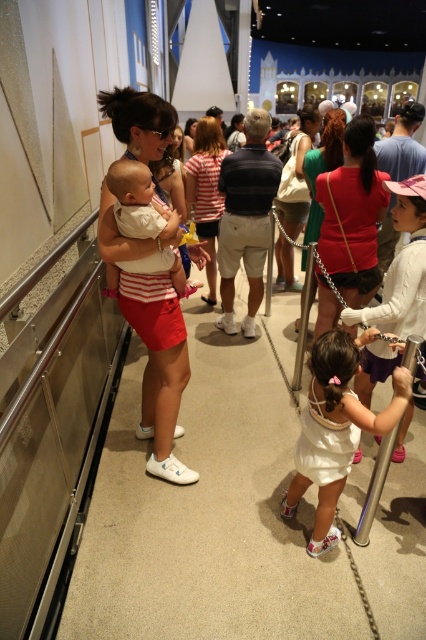
You are standing in the queue line and want to know the position of the matte white shorts at left and the white fabric dress at center. Which one is positioned more to the left?

The matte white shorts at left is positioned more to the left than the white fabric dress at center.

You are standing in the queue line and want to reach the entrance of the attraction. You notice two points marked on the floor ahead of you. The first point is at coordinates point (155, 328), and the second is at point (345, 474). Which point should you step on first to get closer to the entrance?

You should step on point (155, 328) first because it is closer to you than point (345, 474), which is further away.

You are a guest in the Disney park and want to take a photo of the striped cotton shirt at center and the matte white tank top at center. Which one will appear closer to the camera in the photo?

The striped cotton shirt at center will appear closer to the camera in the photo because it is in front of the matte white tank top at center.